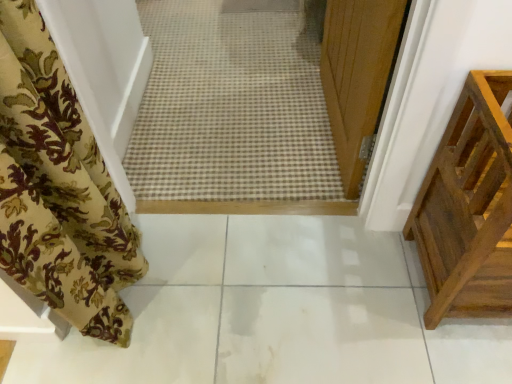
Question: Is floral fabric curtain at left wider than white glossy tile at center?

Choices:
 (A) yes
 (B) no

Answer: (B)

Question: From the image's perspective, is floral fabric curtain at left over white glossy tile at center?

Choices:
 (A) yes
 (B) no

Answer: (A)

Question: Can you confirm if floral fabric curtain at left is smaller than white glossy tile at center?

Choices:
 (A) yes
 (B) no

Answer: (A)

Question: Can you confirm if floral fabric curtain at left is shorter than white glossy tile at center?

Choices:
 (A) no
 (B) yes

Answer: (A)

Question: Can we say floral fabric curtain at left lies outside white glossy tile at center?

Choices:
 (A) yes
 (B) no

Answer: (A)

Question: From a real-world perspective, is brown wooden crate at right above or below floral fabric curtain at left?

Choices:
 (A) above
 (B) below

Answer: (B)

Question: Looking at their shapes, would you say brown wooden crate at right is wider or thinner than floral fabric curtain at left?

Choices:
 (A) thin
 (B) wide

Answer: (B)

Question: Relative to floral fabric curtain at left, is brown wooden crate at right in front or behind?

Choices:
 (A) behind
 (B) front

Answer: (A)

Question: From the image's perspective, relative to floral fabric curtain at left, is brown wooden crate at right above or below?

Choices:
 (A) below
 (B) above

Answer: (A)

Question: In terms of height, does white glossy tile at center look taller or shorter compared to brown wooden crate at right?

Choices:
 (A) tall
 (B) short

Answer: (B)

Question: Is white glossy tile at center inside or outside of brown wooden crate at right?

Choices:
 (A) outside
 (B) inside

Answer: (A)

Question: Based on their positions, is white glossy tile at center located to the left or right of brown wooden crate at right?

Choices:
 (A) right
 (B) left

Answer: (B)

Question: In terms of width, does white glossy tile at center look wider or thinner when compared to brown wooden crate at right?

Choices:
 (A) thin
 (B) wide

Answer: (B)

Question: In terms of height, does floral fabric curtain at left look taller or shorter compared to white glossy tile at center?

Choices:
 (A) short
 (B) tall

Answer: (B)

Question: From the image's perspective, is floral fabric curtain at left located above or below white glossy tile at center?

Choices:
 (A) below
 (B) above

Answer: (B)